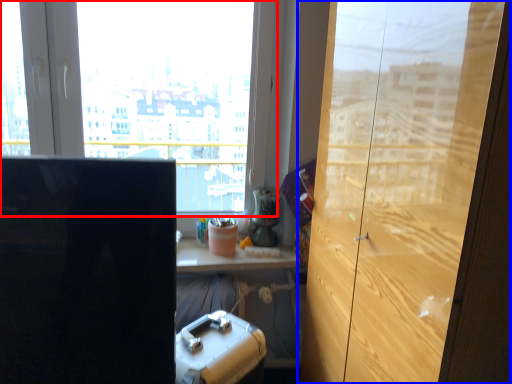
Question: Which of the following is the closest to the observer, window (highlighted by a red box) or cupboard (highlighted by a blue box)?

Choices:
 (A) window
 (B) cupboard

Answer: (B)